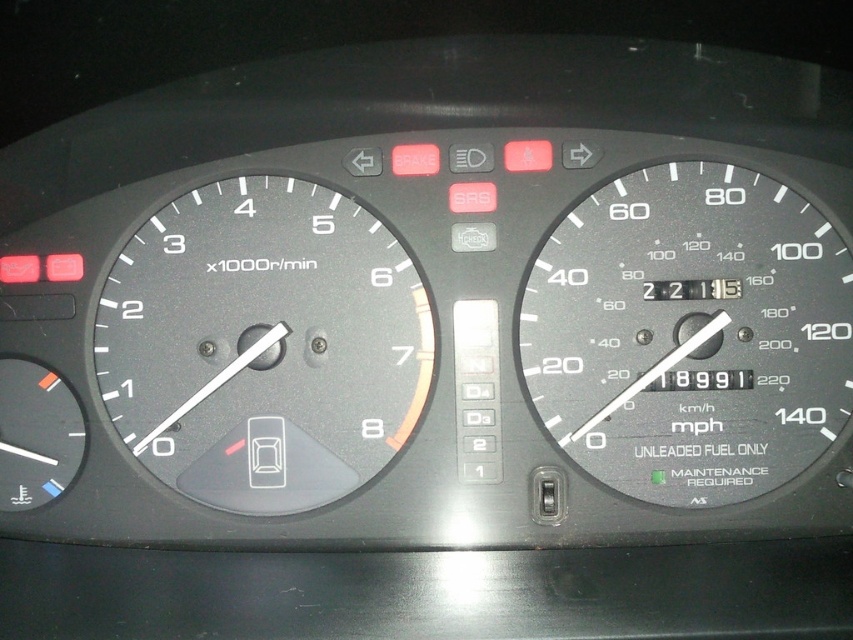
You are a mechanic inspecting a car dashboard. You need to determine if the black matte speedometer at center right can fit into a storage box designed for gauges no wider than the matte black tachometer at left. Can it fit?

The black matte speedometer at center right has a lesser width compared to the matte black tachometer at left, so it can fit into the storage box designed for gauges no wider than the matte black tachometer at left.

You are a mechanic inspecting a car dashboard. You need to replace both the black matte speedometer at center right and the matte black tachometer at left. If you have a limited space in your toolbox, which one should you prioritize packing first based on their size?

The black matte speedometer at center right is larger than the matte black tachometer at left, so you should prioritize packing the black matte speedometer at center right first due to its larger size to ensure it fits in the toolbox.